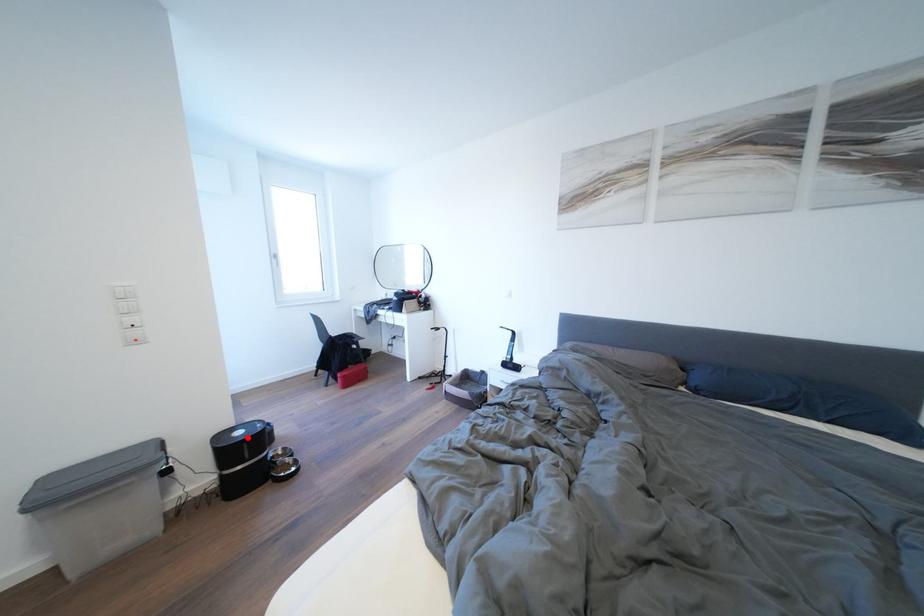
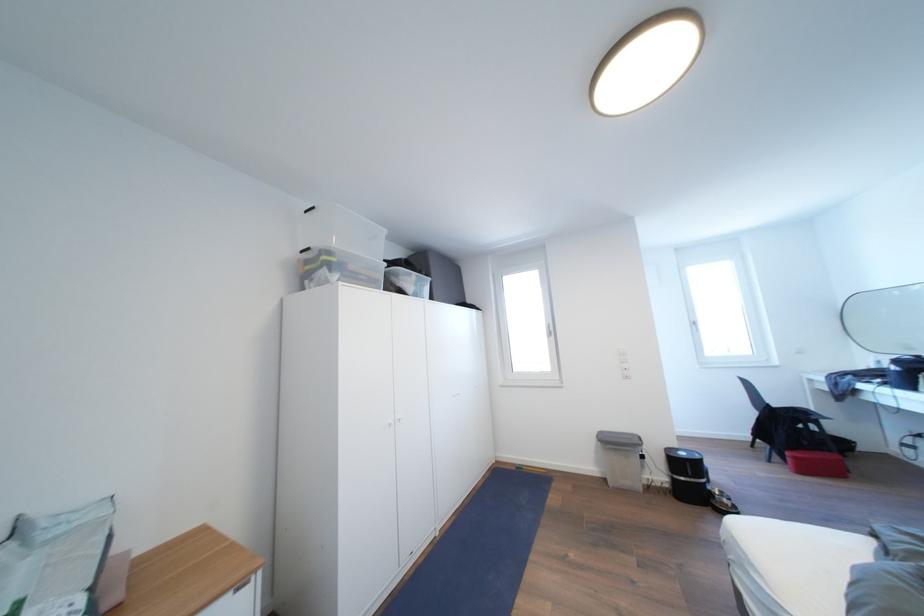
Where in the second image is the point corresponding to the highlighted location from the first image?

(689, 459)